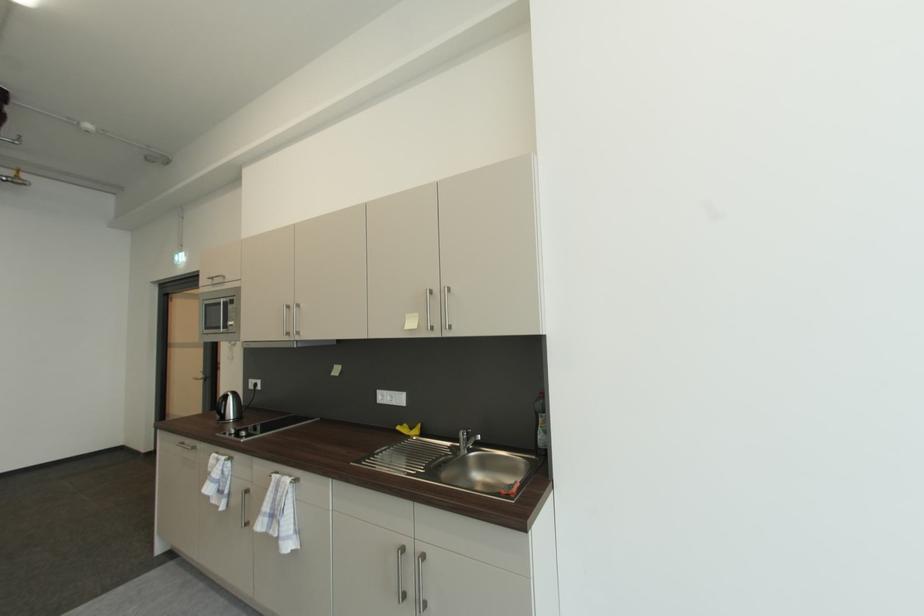
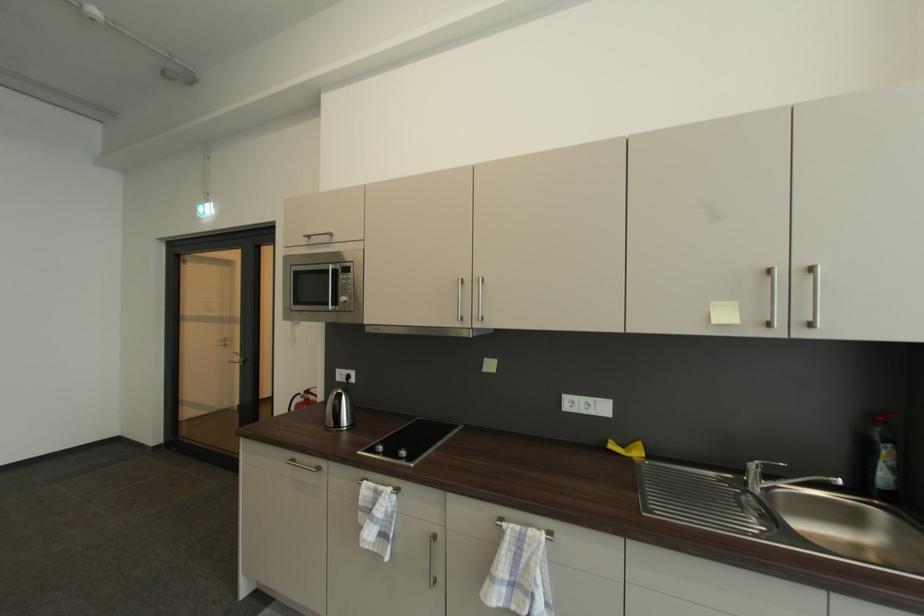
Find the pixel in the second image that matches point 227,304 in the first image.

(334, 272)